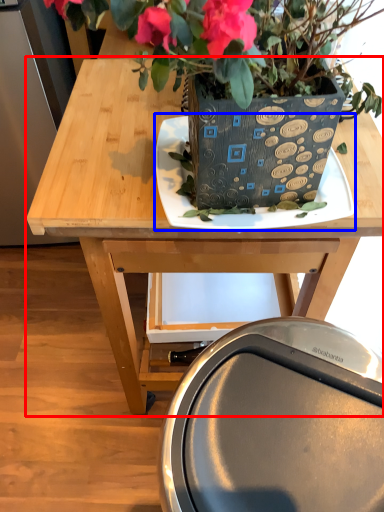
Question: Which point is closer to the camera, table (highlighted by a red box) or plate (highlighted by a blue box)?

Choices:
 (A) table
 (B) plate

Answer: (B)